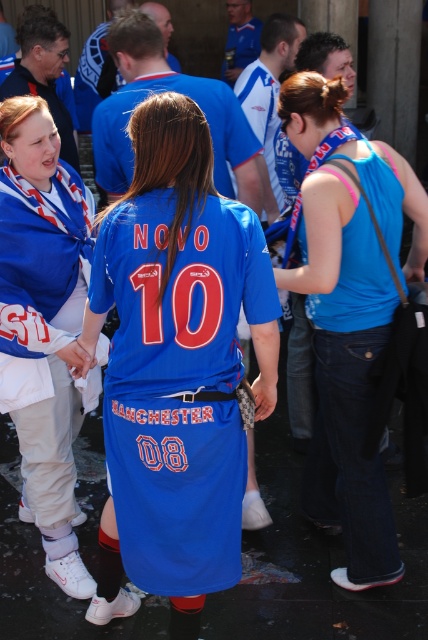
Can you confirm if blue denim jeans at center is taller than matte blue jersey at center?

Yes.

Who is positioned more to the right, blue denim jeans at center or matte blue jersey at center?

Positioned to the right is blue denim jeans at center.

Which is behind, point (365, 214) or point (42, 256)?

Positioned behind is point (42, 256).

Find the location of a particular element. The width and height of the screenshot is (428, 640). blue denim jeans at center is located at coordinates (353, 340).

Can you confirm if blue jersey at center is shorter than matte blue jersey at center?

Yes, blue jersey at center is shorter than matte blue jersey at center.

Consider the image. Between blue jersey at center and matte blue jersey at center, which one has more height?

Standing taller between the two is matte blue jersey at center.

Is point (270, 285) farther from camera compared to point (2, 196)?

No, (270, 285) is in front of (2, 196).

Find the location of a particular element. The width and height of the screenshot is (428, 640). blue jersey at center is located at coordinates coord(177,365).

Which is behind, point (136, 326) or point (320, 440)?

Point (320, 440)

Is point (160, 529) less distant than point (318, 339)?

Yes, it is in front of point (318, 339).

You are a GUI agent. You are given a task and a screenshot of the screen. Output one action in this format:
    pyautogui.click(x=<x>, y=<y>)
    Task: Click on the blue jersey at center
    This screenshot has height=640, width=428.
    Given the screenshot: What is the action you would take?
    pyautogui.click(x=177, y=365)

Where is `blue jersey at center`? This screenshot has height=640, width=428. blue jersey at center is located at coordinates (177, 365).